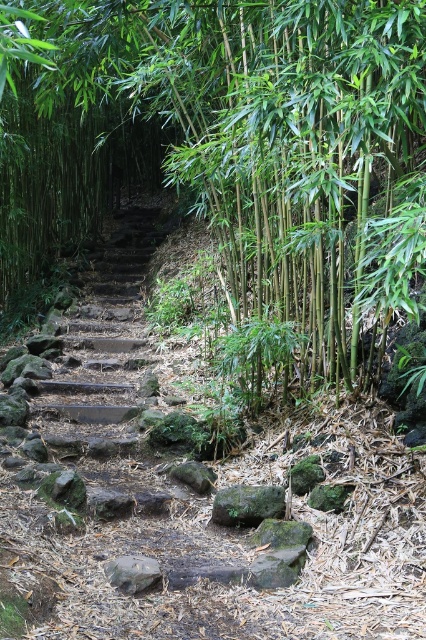
Question: Which point is farther from the camera taking this photo?

Choices:
 (A) (167, 184)
 (B) (152, 560)

Answer: (A)

Question: Which object appears closest to the camera in this image?

Choices:
 (A) gray rough stone at center
 (B) green bamboo at center
 (C) smooth gray rock at center

Answer: (B)

Question: Is green mossy rock at center positioned at the back of smooth gray rock at center?

Choices:
 (A) no
 (B) yes

Answer: (A)

Question: In this image, where is gray rough stone at center located relative to smooth gray rock at center?

Choices:
 (A) left
 (B) right

Answer: (A)

Question: In this image, where is gray rough stone at center located relative to smooth gray rock at center?

Choices:
 (A) left
 (B) right

Answer: (A)

Question: Which object is the farthest from the green mossy rock at center?

Choices:
 (A) smooth gray rock at center
 (B) green bamboo at center
 (C) gray rough stone at center

Answer: (B)